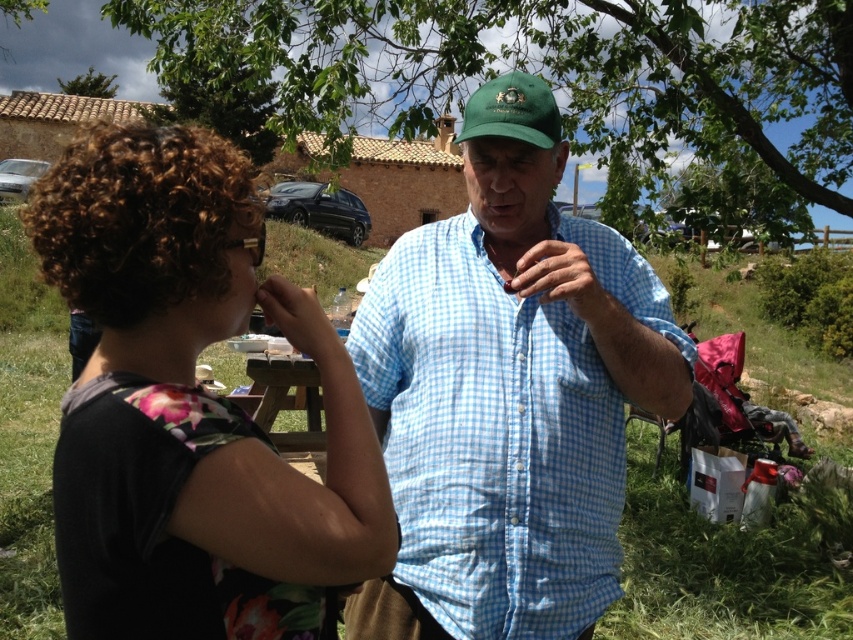
Is blue checkered shirt at center bigger than green leafy tree at upper center?

Yes, blue checkered shirt at center is bigger than green leafy tree at upper center.

Who is positioned more to the left, blue checkered shirt at center or green leafy tree at upper center?

blue checkered shirt at center is more to the left.

The image size is (853, 640). I want to click on blue checkered shirt at center, so click(491, 442).

The height and width of the screenshot is (640, 853). Identify the location of blue checkered shirt at center. (491, 442).

Does green fabric baseball cap at center have a greater height compared to green leafy tree at upper left?

Incorrect, green fabric baseball cap at center's height is not larger of green leafy tree at upper left's.

Does point (541, 120) come in front of point (80, 93)?

Yes, it is.

This screenshot has height=640, width=853. Find the location of `green fabric baseball cap at center`. green fabric baseball cap at center is located at coordinates pyautogui.click(x=512, y=109).

Locate an element on the screen. Image resolution: width=853 pixels, height=640 pixels. green fabric baseball cap at center is located at coordinates (512, 109).

Does green leafy tree at upper center have a greater width compared to green grass at center?

No.

Is green leafy tree at upper center taller than green grass at center?

No.

Which is behind, point (544, 8) or point (630, 504)?

The point (630, 504) is more distant.

I want to click on green leafy tree at upper center, so click(546, 68).